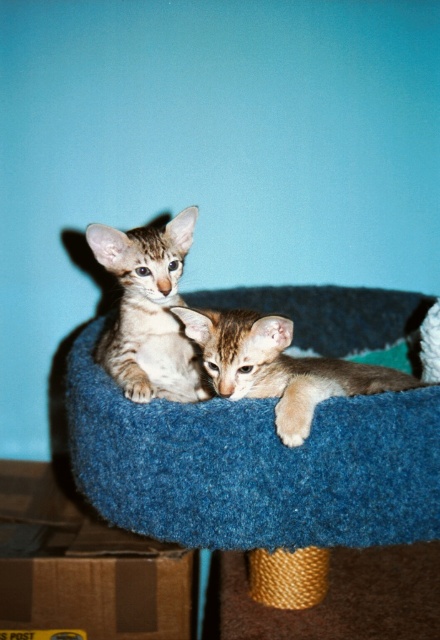
Which is above, brown cardboard box at lower left or light brown fur kitten at center?

light brown fur kitten at center is higher up.

The width and height of the screenshot is (440, 640). Describe the element at coordinates (84, 566) in the screenshot. I see `brown cardboard box at lower left` at that location.

Describe the element at coordinates (84, 566) in the screenshot. I see `brown cardboard box at lower left` at that location.

Identify the location of brown cardboard box at lower left. (84, 566).

Between brown cardboard box at lower left and tabby fur kitten at center, which one is positioned lower?

brown cardboard box at lower left

Image resolution: width=440 pixels, height=640 pixels. I want to click on brown cardboard box at lower left, so click(x=84, y=566).

Between blue felt cat bed at center and brown cardboard box at lower left, which one is positioned higher?

Positioned higher is blue felt cat bed at center.

What do you see at coordinates (252, 465) in the screenshot? I see `blue felt cat bed at center` at bounding box center [252, 465].

Locate an element on the screen. blue felt cat bed at center is located at coordinates (252, 465).